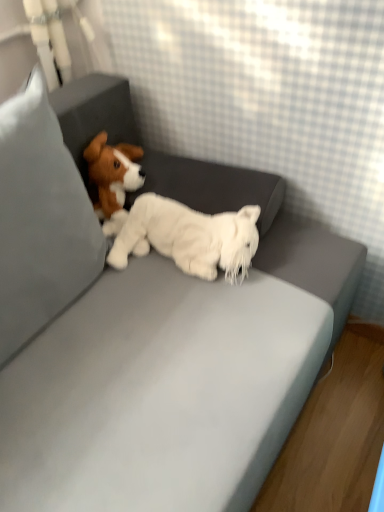
In order to click on vacant space underneath white plush toy at center (from a real-world perspective) in this screenshot , I will do `click(180, 264)`.